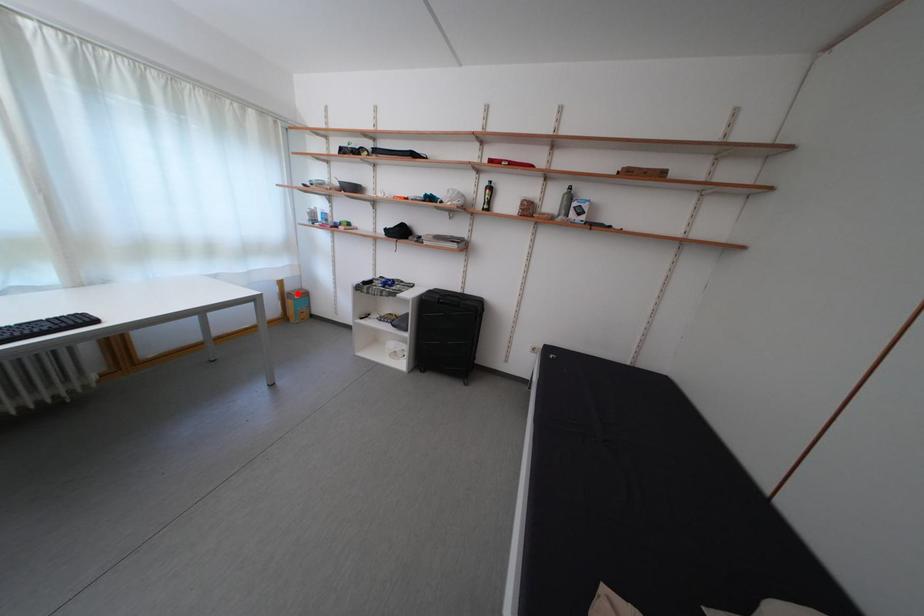
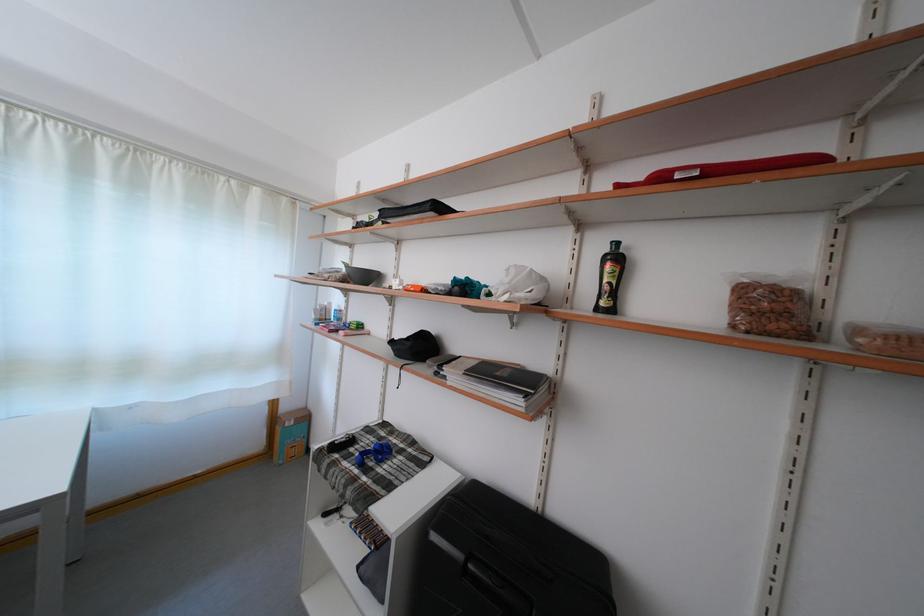
Question: I am providing you with two images of the same scene from different viewpoints. Given a red point in image1, look at the same physical point in image2. Is it:

Choices:
 (A) Closer to the viewpoint
 (B) Farther from the viewpoint

Answer: (A)